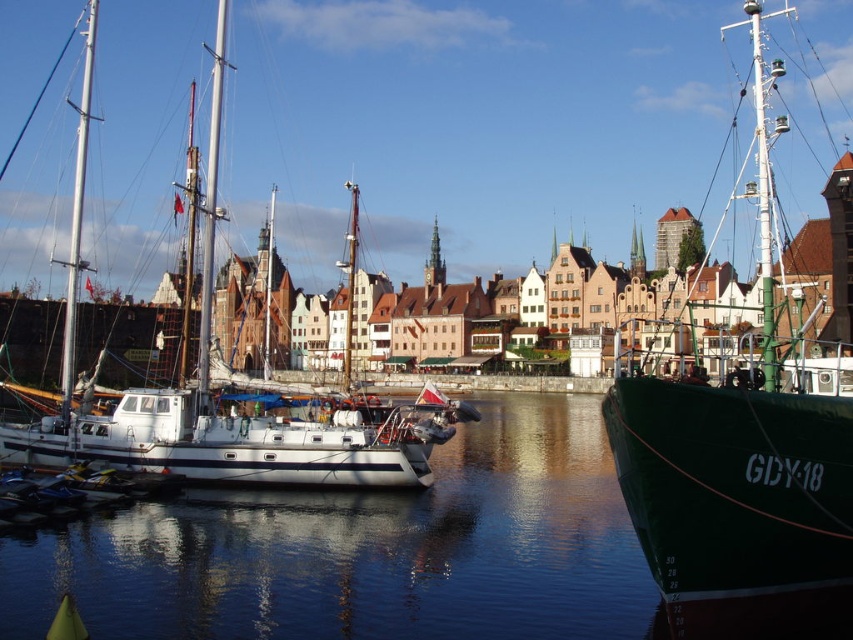
Question: Can you confirm if green matte ship at right is wider than white matte sailboat at left?

Choices:
 (A) yes
 (B) no

Answer: (B)

Question: Does green matte ship at right appear under white matte sailboat at left?

Choices:
 (A) no
 (B) yes

Answer: (A)

Question: Which point is farther from the camera taking this photo?

Choices:
 (A) (695, 384)
 (B) (283, 588)
 (C) (192, 410)

Answer: (C)

Question: Is clear water at center smaller than white matte sailboat at left?

Choices:
 (A) no
 (B) yes

Answer: (B)

Question: Which object is the closest to the green matte ship at right?

Choices:
 (A) clear water at center
 (B) white matte sailboat at left

Answer: (A)

Question: Which point is closer to the camera taking this photo?

Choices:
 (A) (90, 419)
 (B) (410, 522)
 (C) (614, 436)

Answer: (C)